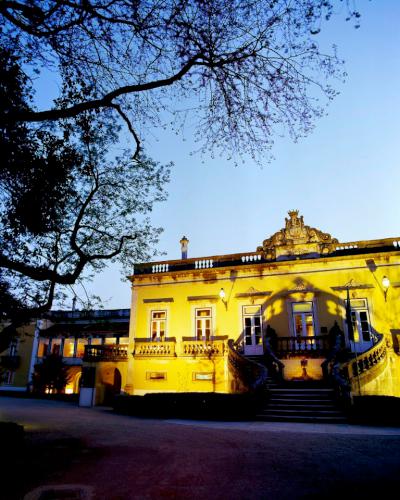
At what (x,y) coordinates should I click in order to perform the action: click on 2 small windows on first floor. Please return your answer as a coordinate pair (x, y). The height and width of the screenshot is (500, 400). Looking at the image, I should click on (153, 376), (203, 380).